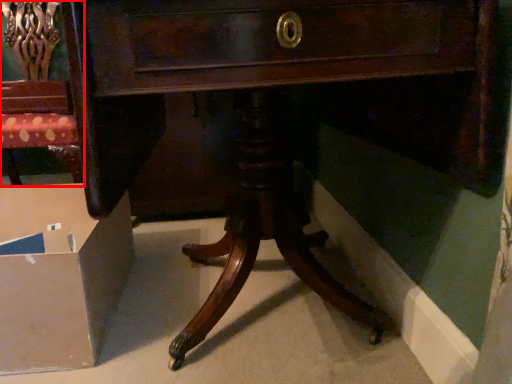
Question: From the image's perspective, where is chair (annotated by the red box) located in relation to cardboard box in the image?

Choices:
 (A) below
 (B) above

Answer: (B)